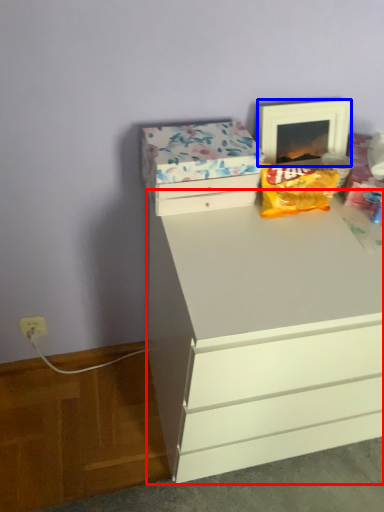
Question: Among these objects, which one is nearest to the camera, chest of drawers (highlighted by a red box) or picture frame (highlighted by a blue box)?

Choices:
 (A) chest of drawers
 (B) picture frame

Answer: (A)